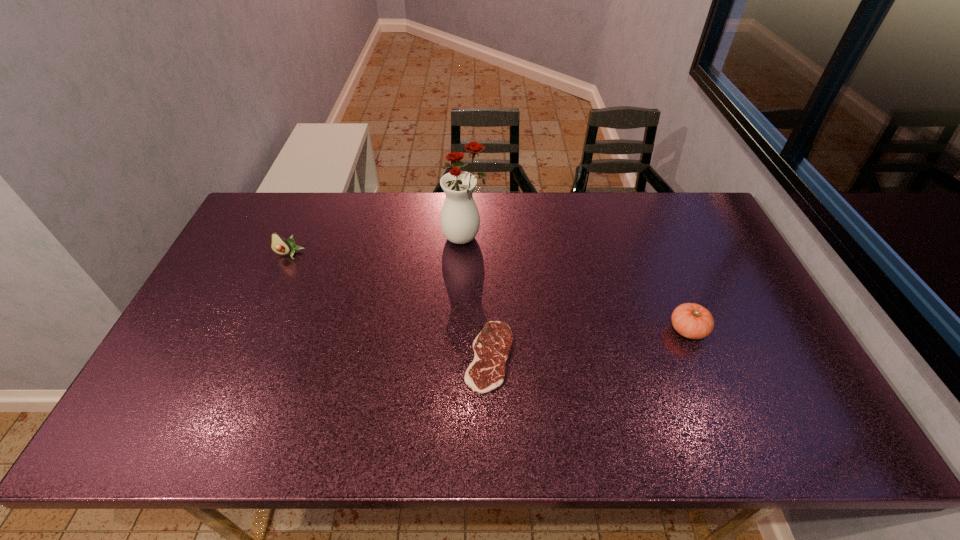
Identify the location of vase. (460, 220).

This screenshot has width=960, height=540. In order to click on the leftmost object in this screenshot , I will do `click(279, 245)`.

The width and height of the screenshot is (960, 540). Identify the location of avocado. (279, 245).

Where is `the rightmost object`? The height and width of the screenshot is (540, 960). the rightmost object is located at coordinates (691, 320).

Identify the location of tomato. (691, 320).

You are a GUI agent. You are given a task and a screenshot of the screen. Output one action in this format:
    pyautogui.click(x=<x>, y=<y>)
    Task: Click on the shortest object
    This screenshot has width=960, height=540.
    Given the screenshot: What is the action you would take?
    tap(492, 346)

Locate an element on the screen. vacant space situated 0.150m on the right of the vase is located at coordinates (533, 238).

The width and height of the screenshot is (960, 540). In order to click on free space located on the seed side of the avocado in this screenshot , I will do `click(280, 275)`.

The image size is (960, 540). Find the location of `free space located 0.110m on the back of the rightmost object`. free space located 0.110m on the back of the rightmost object is located at coordinates (670, 286).

Where is `vacant position located on the left of the steak`? This screenshot has width=960, height=540. vacant position located on the left of the steak is located at coordinates (372, 356).